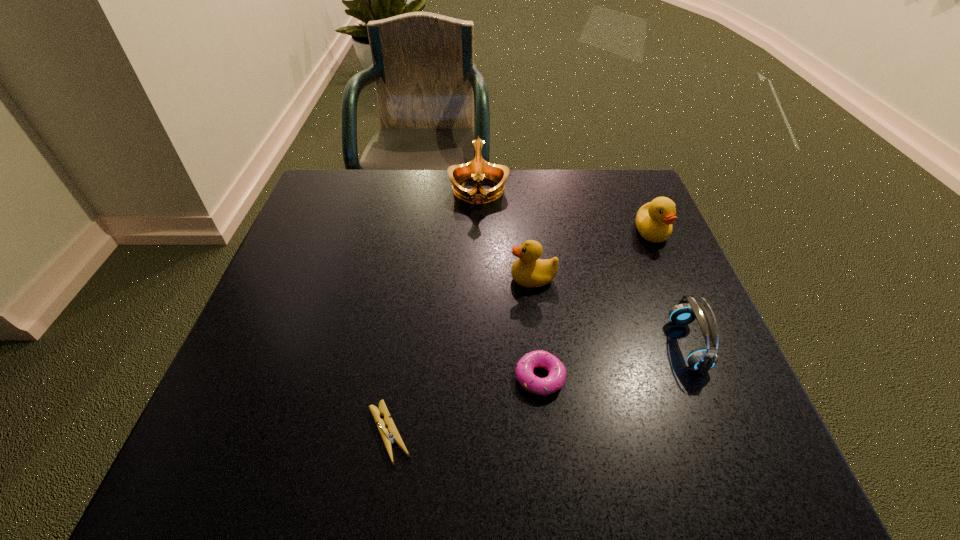
This screenshot has width=960, height=540. I want to click on free space located at the beak of the fifth nearest object, so click(698, 340).

Find the location of a particular element. vacant space situated 0.340m at the beak of the third farthest object is located at coordinates (356, 279).

Image resolution: width=960 pixels, height=540 pixels. I want to click on vacant space located at the beak of the third farthest object, so click(433, 279).

You are a GUI agent. You are given a task and a screenshot of the screen. Output one action in this format:
    pyautogui.click(x=<x>, y=<y>)
    Task: Click on the vacant position located 0.320m at the beak of the third farthest object
    Image resolution: width=960 pixels, height=540 pixels.
    Given the screenshot: What is the action you would take?
    pyautogui.click(x=365, y=279)

Where is `vacant space located on the ear cups of the headset`? vacant space located on the ear cups of the headset is located at coordinates (633, 345).

At what (x,y) coordinates should I click in order to perform the action: click on vacant space located 0.310m on the ear cups of the headset. Please return your answer as a coordinate pair (x, y). The height and width of the screenshot is (540, 960). Looking at the image, I should click on (513, 345).

Find the location of `vacant space situated on the ear cups of the headset`. vacant space situated on the ear cups of the headset is located at coordinates (633, 345).

The image size is (960, 540). What are the coordinates of `blank space located on the left of the doughnut` in the screenshot? It's located at (354, 377).

Locate an element on the screen. The image size is (960, 540). free space located 0.180m on the back of the shortest object is located at coordinates (406, 322).

This screenshot has height=540, width=960. I want to click on tiara that is positioned at the far edge, so click(478, 168).